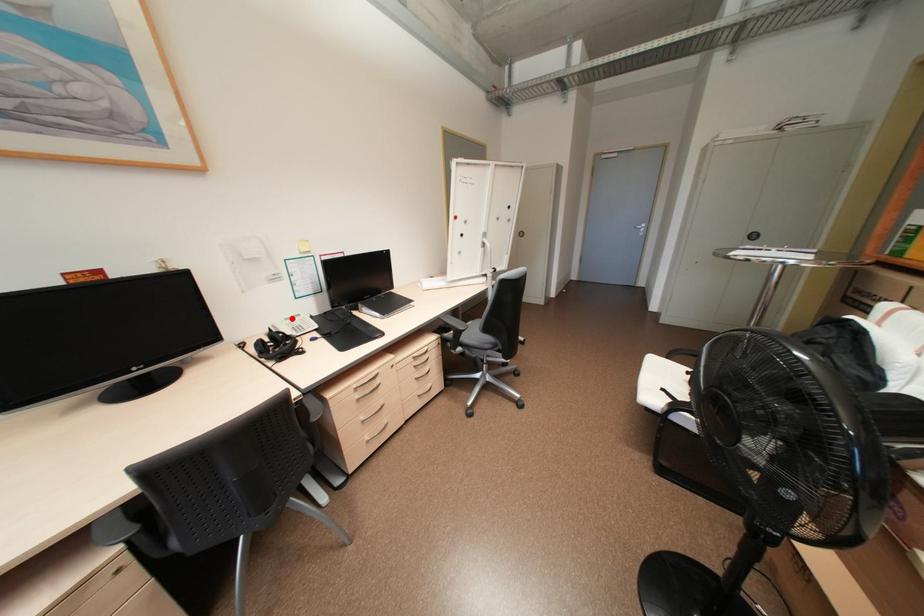
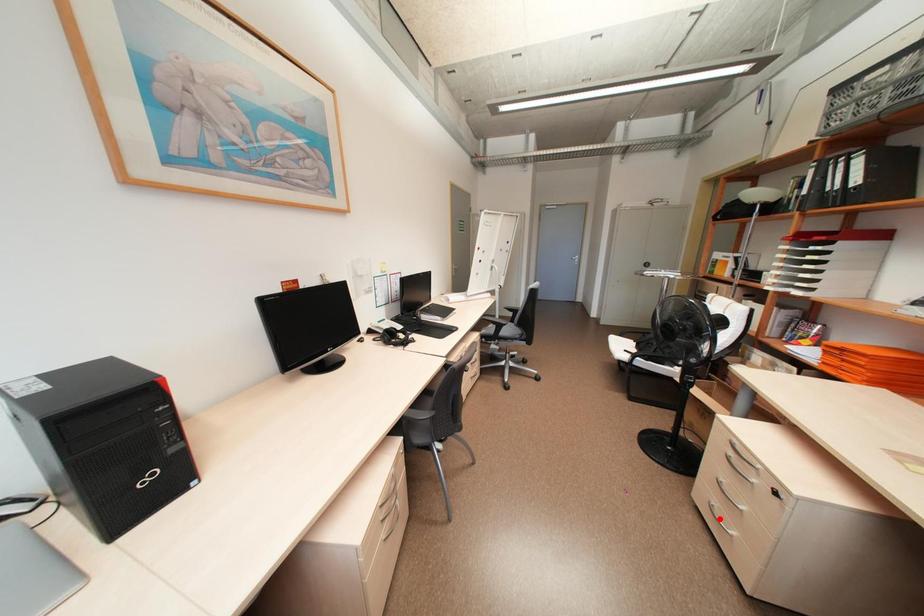
Based on the photo, I am providing you with two images of the same scene from different viewpoints. A red point is marked on the first image and another point is marked on the second image. Are the points marked in image1 and image2 representing the same 3D position?

No